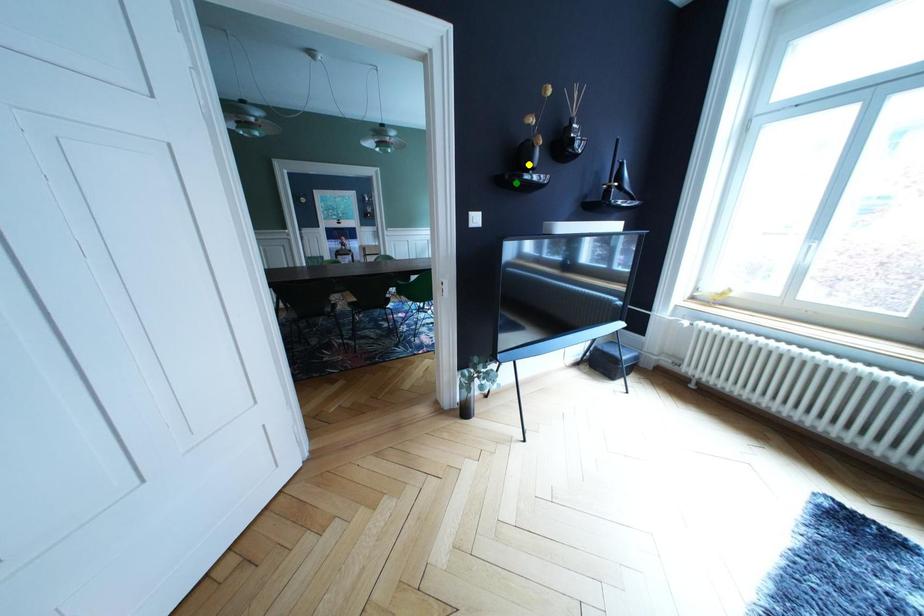
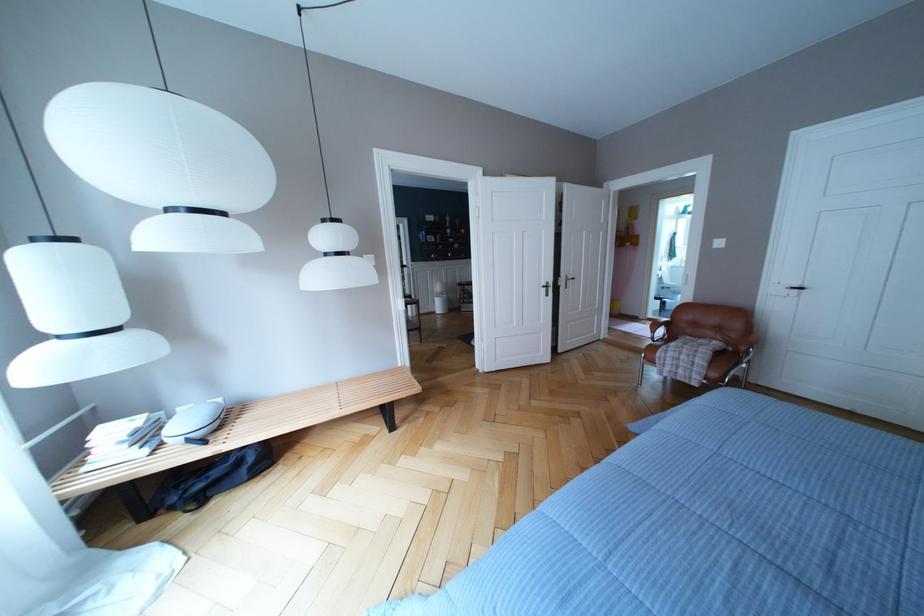
I am providing you with two images of the same scene from different viewpoints. Three points are marked in image1. Which point corresponds to a part or object that is occluded in image2?In image1, three points are marked. Which of them correspond to a part or object that is occluded in image2?Among the three points shown in image1, which one corresponds to a part or object that is no longer visible due to occlusion in image2?

yellow point, blue point, green point